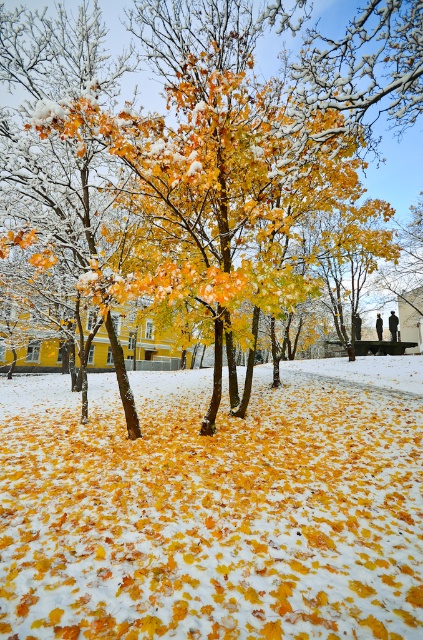
You are standing in the winter scene and notice the yellow matte leaves at center and the yellow matte tree at center. Which object is positioned lower in the scene?

The yellow matte leaves at center are positioned below the yellow matte tree at center, so they are lower in the scene.

You are an artist sketching this winter scene. You want to ensure the yellow matte leaves at center and the yellow matte tree at center are proportionally accurate. Which object should you draw smaller in your sketch?

The yellow matte leaves at center should be drawn smaller since they have a lesser width compared to the yellow matte tree at center.